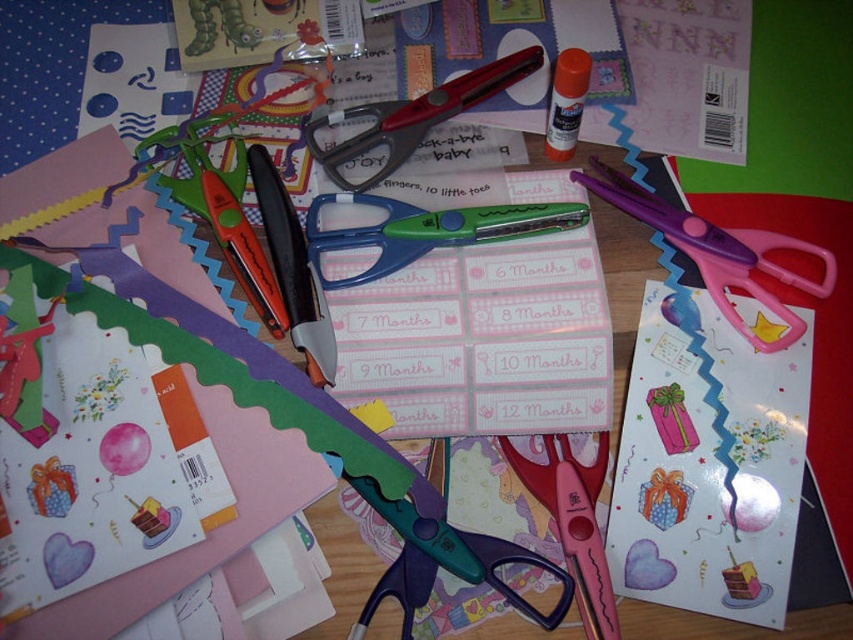
Question: Among these objects, which one is farthest from the camera?

Choices:
 (A) metallic red scissors at center
 (B) green plastic scissors at center
 (C) pink plastic scissors at center
 (D) pink plastic scissors at upper right

Answer: (A)

Question: Does blue plastic scissors at center appear on the left side of black plastic utility knife at center?

Choices:
 (A) no
 (B) yes

Answer: (A)

Question: Which of the following is the closest to the observer?

Choices:
 (A) matte plastic glue stick at upper center
 (B) pink plastic scissors at center
 (C) matte pink card at center
 (D) black plastic utility knife at center

Answer: (B)

Question: Is orange plastic scissors at center thinner than pink plastic scissors at center?

Choices:
 (A) no
 (B) yes

Answer: (A)

Question: Which of the following is the closest to the observer?

Choices:
 (A) matte pink card at center
 (B) pink plastic scissors at center
 (C) black plastic utility knife at center

Answer: (B)

Question: Can you confirm if orange plastic scissors at center is positioned above metallic red scissors at center?

Choices:
 (A) no
 (B) yes

Answer: (A)